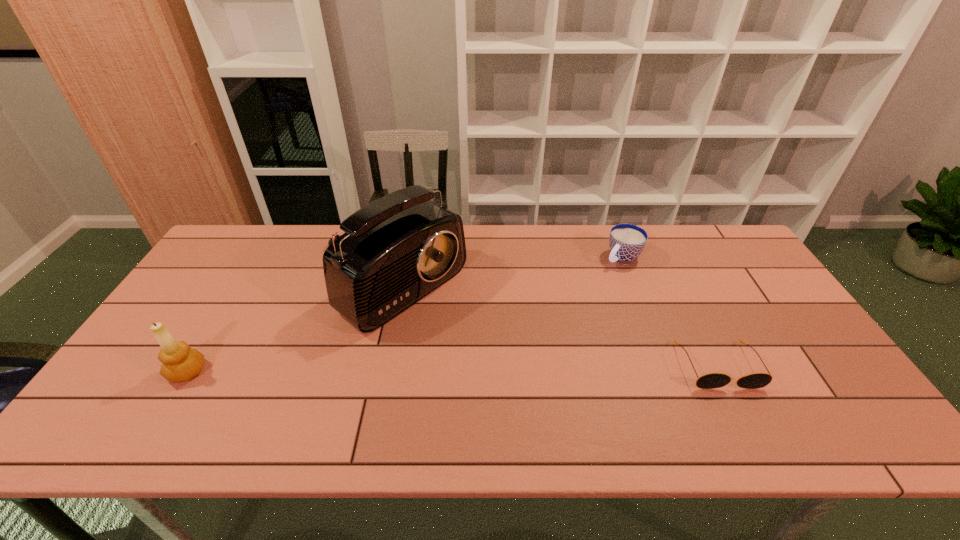
Find the location of a particular element. This screenshot has width=960, height=540. the leftmost object is located at coordinates (180, 363).

The image size is (960, 540). What are the coordinates of `the third shortest object` in the screenshot? It's located at (180, 363).

Image resolution: width=960 pixels, height=540 pixels. I want to click on the shortest object, so click(x=711, y=380).

Where is `the second shortest object`? the second shortest object is located at coordinates (627, 241).

Identify the location of radio receiver. Image resolution: width=960 pixels, height=540 pixels. (397, 249).

Where is `the third object from right to left`? This screenshot has height=540, width=960. the third object from right to left is located at coordinates (397, 249).

Locate an element on the screen. vacant space situated 0.100m on the right of the leftmost object is located at coordinates (247, 372).

This screenshot has width=960, height=540. I want to click on free space located on the side of the cup with the handle, so click(x=588, y=287).

Identify the location of free spot located 0.210m on the side of the cup with the handle. (574, 299).

Identify the location of vacant position located on the side of the cup with the handle. The width and height of the screenshot is (960, 540). (598, 278).